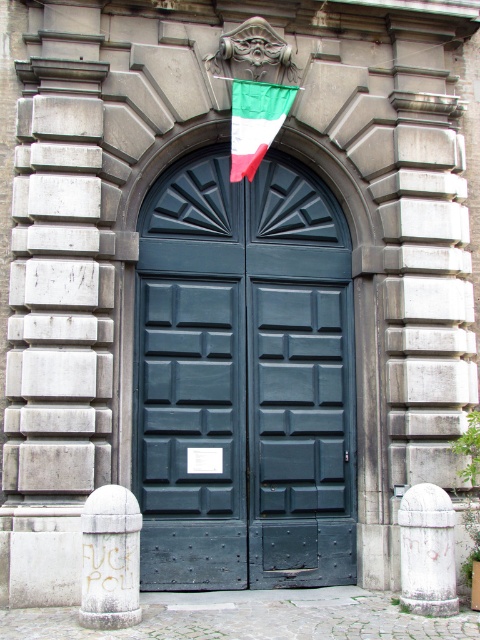
Who is taller, white stone pillar at lower right or green fabric flag at center?

With more height is green fabric flag at center.

Is point (428, 513) positioned before point (277, 128)?

Yes, point (428, 513) is in front of point (277, 128).

Measure the distance between point (x=431, y=605) and camera.

They are 7.41 meters apart.

Where is `white stone pillar at lower right`? The image size is (480, 640). white stone pillar at lower right is located at coordinates (428, 550).

Which is more to the left, white stone bollard at lower left or green fabric flag at center?

From the viewer's perspective, white stone bollard at lower left appears more on the left side.

Which is behind, point (117, 627) or point (254, 148)?

The point (254, 148) is behind.

Identify the location of white stone bollard at lower left. This screenshot has width=480, height=640. (109, 557).

Can you confirm if matte dark green door at center is thinner than white stone pillar at lower right?

In fact, matte dark green door at center might be wider than white stone pillar at lower right.

Which is more to the left, matte dark green door at center or white stone pillar at lower right?

From the viewer's perspective, matte dark green door at center appears more on the left side.

Is point (147, 566) in front of point (416, 544)?

No, (147, 566) is further to viewer.

Locate an element on the screen. The image size is (480, 640). matte dark green door at center is located at coordinates (243, 380).